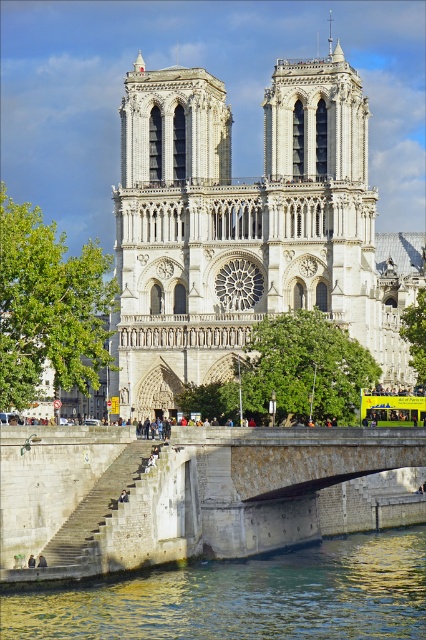
Is point (359, 516) positioned after point (374, 419)?

Yes, it is behind point (374, 419).

Between point (215, 532) and point (394, 419), which one is positioned behind?

Positioned behind is point (394, 419).

The width and height of the screenshot is (426, 640). What do you see at coordinates (203, 496) in the screenshot? I see `stone bridge at lower center` at bounding box center [203, 496].

The width and height of the screenshot is (426, 640). I want to click on stone bridge at lower center, so click(203, 496).

Measure the distance from stone bridge at lower center to greenish water at lower center.

The distance of stone bridge at lower center from greenish water at lower center is 5.17 meters.

From the picture: Who is higher up, stone bridge at lower center or greenish water at lower center?

Positioned higher is stone bridge at lower center.

Where is `stone bridge at lower center`? The height and width of the screenshot is (640, 426). stone bridge at lower center is located at coordinates (203, 496).

Find the location of a particular element. The width and height of the screenshot is (426, 640). stone bridge at lower center is located at coordinates (203, 496).

Between point (104, 611) and point (385, 392), which one is positioned behind?

The point (385, 392) is behind.

Is point (23, 592) farther from viewer compared to point (363, 420)?

No, it is in front of (363, 420).

Which is in front, point (273, 637) or point (373, 394)?

Point (273, 637) is in front.

The width and height of the screenshot is (426, 640). I want to click on greenish water at lower center, so click(244, 596).